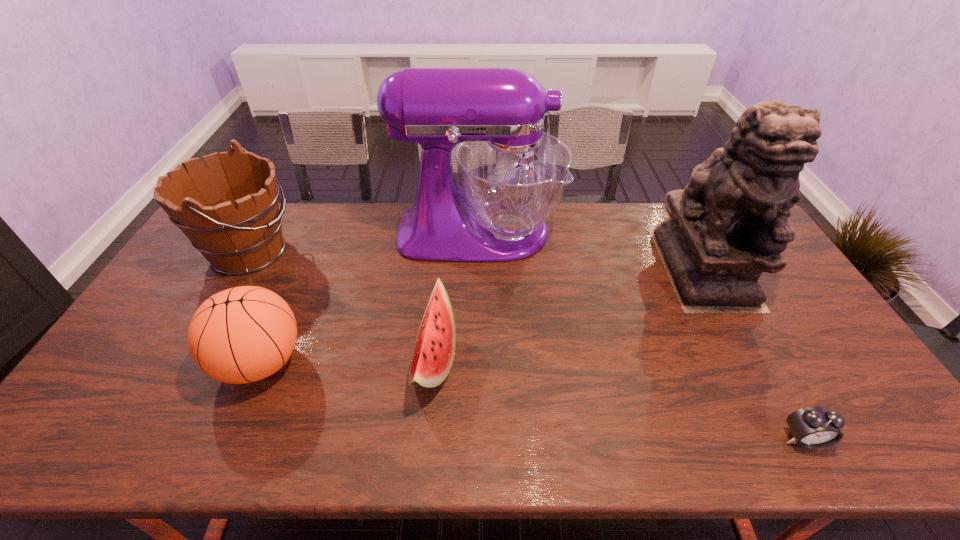
Identify the location of vacant space located 0.100m on the left of the basketball. This screenshot has width=960, height=540. (178, 362).

The width and height of the screenshot is (960, 540). I want to click on vacant space located 0.330m on the outer rind of the fifth tallest object, so click(x=580, y=360).

The width and height of the screenshot is (960, 540). Find the location of `mixer that is at the far edge`. mixer that is at the far edge is located at coordinates (512, 175).

The image size is (960, 540). What are the coordinates of `sculpture located in the far edge section of the desktop` in the screenshot? It's located at (730, 223).

What are the coordinates of `wine bucket present at the far edge` in the screenshot? It's located at (229, 211).

You are a GUI agent. You are given a task and a screenshot of the screen. Output one action in this format:
    pyautogui.click(x=<x>, y=<y>)
    Task: Click on the object at the near edge
    This screenshot has height=540, width=960.
    Given the screenshot: What is the action you would take?
    pyautogui.click(x=815, y=427)

What are the coordinates of `object positioned at the left edge` in the screenshot? It's located at (229, 211).

Find the location of a particular element. This screenshot has height=540, width=960. object that is at the right edge is located at coordinates (730, 223).

Find the location of a particular element. object present at the far left corner is located at coordinates (229, 211).

Where is `object that is positioned at the far right corner`? Image resolution: width=960 pixels, height=540 pixels. object that is positioned at the far right corner is located at coordinates (730, 223).